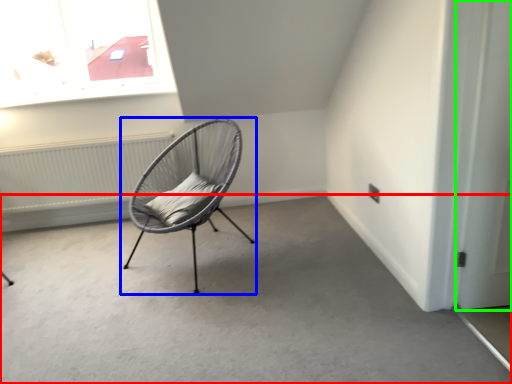
Question: Based on their relative distances, which object is farther from concrete (highlighted by a red box)? Choose from chair (highlighted by a blue box) and door (highlighted by a green box).

Choices:
 (A) chair
 (B) door

Answer: (B)